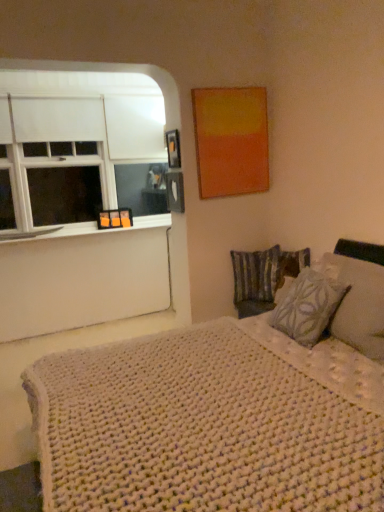
Where is `free spot above white painted wood at left (from a real-world perspective)`? Image resolution: width=384 pixels, height=512 pixels. free spot above white painted wood at left (from a real-world perspective) is located at coordinates (91, 229).